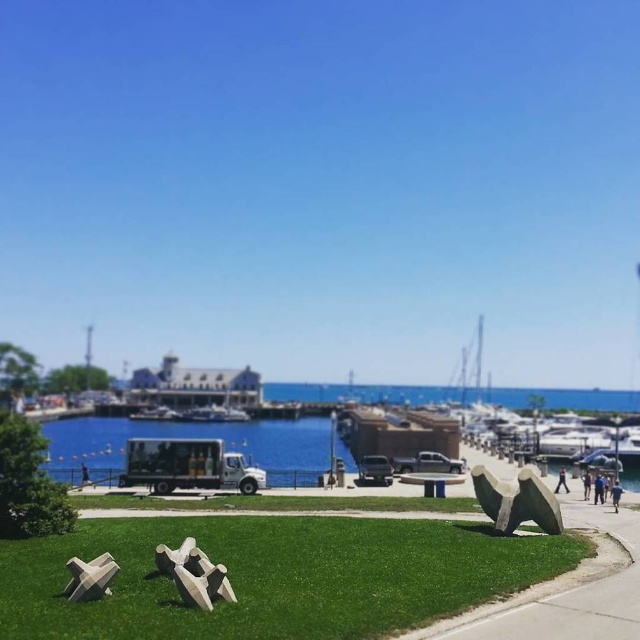
You are a photographer trying to capture the entire green grass at lower center and blue fabric person at lower right in a single frame. Based on their sizes, which object should you focus on to ensure both are visible in the photo?

The green grass at lower center is larger than the blue fabric person at lower right, so focusing on the green grass at lower center will help ensure both are visible in the photo.

You are standing at the camera position and want to reach the gray concrete sculpture at center. The path is 10 meters long. Can you walk directly to it without needing to detour around any obstacles?

The gray concrete sculpture at center is 13.52 meters away from camera, which is longer than the 10 meters path length. Therefore, you would need to detour around obstacles to reach it.